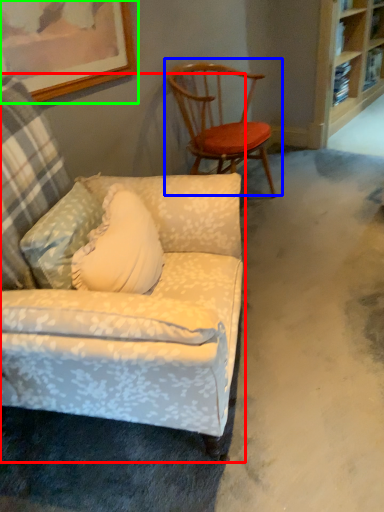
Question: Based on their relative distances, which object is farther from chair (highlighted by a red box)? Choose from chair (highlighted by a blue box) and picture frame (highlighted by a green box).

Choices:
 (A) chair
 (B) picture frame

Answer: (A)